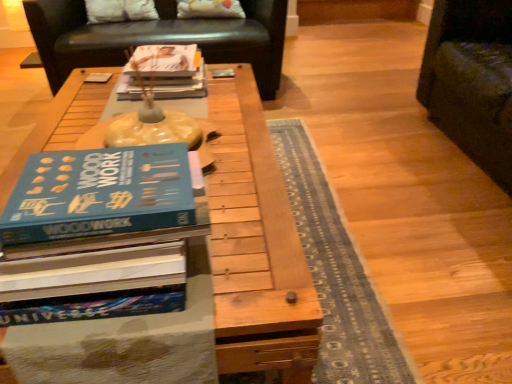
Question: Looking at the image, does white fabric pillow at upper center, the 2th pillow viewed from the right, seem bigger or smaller compared to white fabric pillow at upper center, positioned as the 1th pillow in right-to-left order?

Choices:
 (A) small
 (B) big

Answer: (A)

Question: Looking at their shapes, would you say white fabric pillow at upper center, which is counted as the first pillow, starting from the left, is wider or thinner than white fabric pillow at upper center, the second pillow viewed from the left?

Choices:
 (A) thin
 (B) wide

Answer: (A)

Question: Estimate the real-world distances between objects in this image. Which object is farther from the matte paper book at center?

Choices:
 (A) black leather couch at upper center
 (B) white fabric pillow at upper center, positioned as the 1th pillow in right-to-left order
 (C) wooden table at center
 (D) white fabric pillow at upper center, which is counted as the first pillow, starting from the left

Answer: (D)

Question: Based on their relative distances, which object is farther from the matte paper book at center?

Choices:
 (A) black leather couch at upper center
 (B) wooden table at center
 (C) white fabric pillow at upper center, the second pillow viewed from the left
 (D) white fabric pillow at upper center, the 2th pillow viewed from the right

Answer: (D)